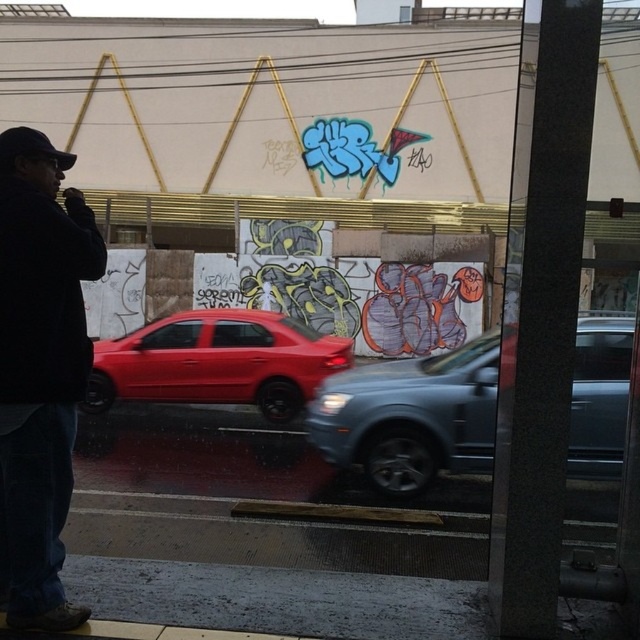
Does metallic gray suv at center have a lesser width compared to glossy red car at center?

No.

Is metallic gray suv at center above glossy red car at center?

No, metallic gray suv at center is not above glossy red car at center.

At what (x,y) coordinates should I click in order to perform the action: click on metallic gray suv at center. Please return your answer as a coordinate pair (x, y). Looking at the image, I should click on (412, 417).

Locate an element on the screen. The height and width of the screenshot is (640, 640). metallic gray suv at center is located at coordinates tap(412, 417).

Can you confirm if dark blue jacket at left is wider than metallic gray suv at center?

In fact, dark blue jacket at left might be narrower than metallic gray suv at center.

Does dark blue jacket at left have a smaller size compared to metallic gray suv at center?

Yes, dark blue jacket at left is smaller than metallic gray suv at center.

What do you see at coordinates (38, 371) in the screenshot? I see `dark blue jacket at left` at bounding box center [38, 371].

Find the location of a particular element. The height and width of the screenshot is (640, 640). dark blue jacket at left is located at coordinates (38, 371).

Which is in front, point (52, 557) or point (301, 378)?

Point (52, 557) is more forward.

Can you confirm if dark blue jacket at left is positioned to the left of glossy red car at center?

In fact, dark blue jacket at left is to the right of glossy red car at center.

You are a GUI agent. You are given a task and a screenshot of the screen. Output one action in this format:
    pyautogui.click(x=<x>, y=<y>)
    Task: Click on the dark blue jacket at left
    The image size is (640, 640).
    Given the screenshot: What is the action you would take?
    pyautogui.click(x=38, y=371)

Image resolution: width=640 pixels, height=640 pixels. I want to click on dark blue jacket at left, so click(x=38, y=371).